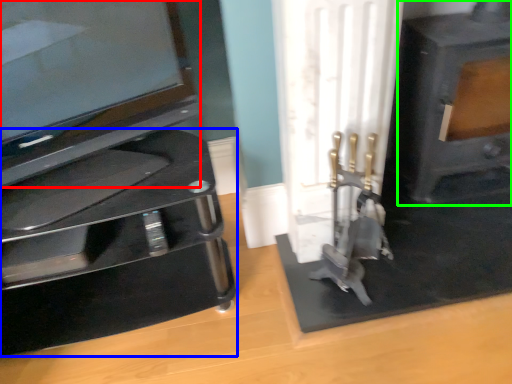
Question: Which object is positioned farthest from television (highlighted by a red box)? Select from furniture (highlighted by a blue box) and fireplace (highlighted by a green box).

Choices:
 (A) furniture
 (B) fireplace

Answer: (B)